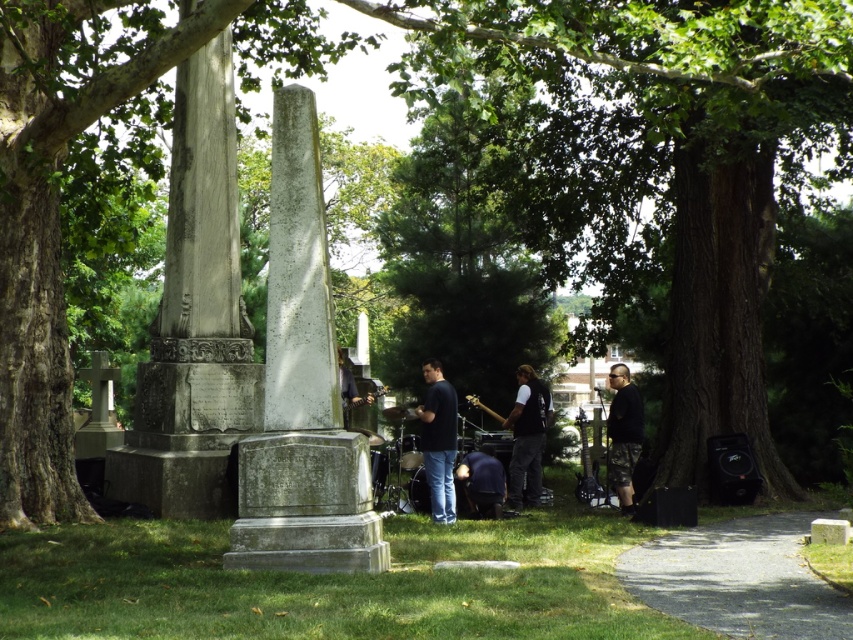
Question: Does dark blue shirt at center have a lesser width compared to camouflage pants at lower right?

Choices:
 (A) no
 (B) yes

Answer: (B)

Question: Estimate the real-world distances between objects in this image. Which object is farther from the gray polished stone obelisk at center?

Choices:
 (A) black matte vest at center
 (B) gray stone monument at center
 (C) dark blue shirt at center

Answer: (A)

Question: Which point appears farthest from the camera in this image?

Choices:
 (A) (428, 381)
 (B) (308, 212)
 (C) (239, 502)
 (D) (624, 406)

Answer: (D)

Question: Which point is farther to the camera?

Choices:
 (A) (432, 442)
 (B) (310, 212)

Answer: (A)

Question: Does gray stone monument at center appear under camouflage pants at lower right?

Choices:
 (A) yes
 (B) no

Answer: (B)

Question: Considering the relative positions of gray stone monument at center and gray polished stone obelisk at center in the image provided, where is gray stone monument at center located with respect to gray polished stone obelisk at center?

Choices:
 (A) left
 (B) right

Answer: (B)